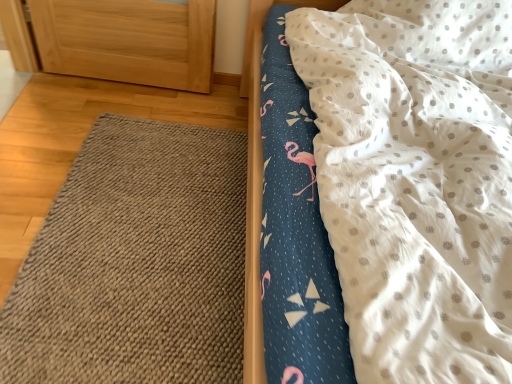
Question: In the image, is brown woven mat at lower left on the left side or the right side of white dotted fabric at upper right?

Choices:
 (A) right
 (B) left

Answer: (B)

Question: From the image's perspective, is brown woven mat at lower left located above or below white dotted fabric at upper right?

Choices:
 (A) above
 (B) below

Answer: (B)

Question: Considering their positions, is brown woven mat at lower left located in front of or behind white dotted fabric at upper right?

Choices:
 (A) front
 (B) behind

Answer: (B)

Question: From the image's perspective, is white dotted fabric at upper right positioned above or below brown woven mat at lower left?

Choices:
 (A) above
 (B) below

Answer: (A)

Question: Based on their sizes in the image, would you say white dotted fabric at upper right is bigger or smaller than brown woven mat at lower left?

Choices:
 (A) big
 (B) small

Answer: (A)

Question: Looking at their shapes, would you say white dotted fabric at upper right is wider or thinner than brown woven mat at lower left?

Choices:
 (A) thin
 (B) wide

Answer: (B)

Question: Relative to brown woven mat at lower left, is white dotted fabric at upper right in front or behind?

Choices:
 (A) front
 (B) behind

Answer: (A)